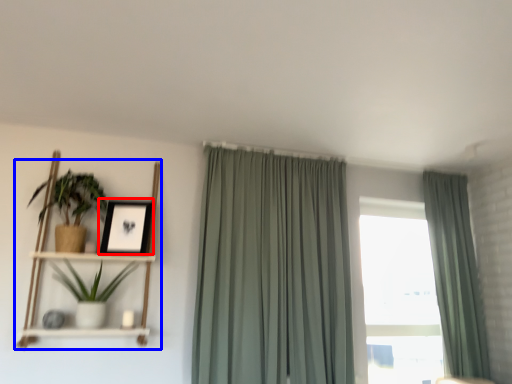
Question: Which point is further to the camera, picture frame (highlighted by a red box) or shelf (highlighted by a blue box)?

Choices:
 (A) picture frame
 (B) shelf

Answer: (A)